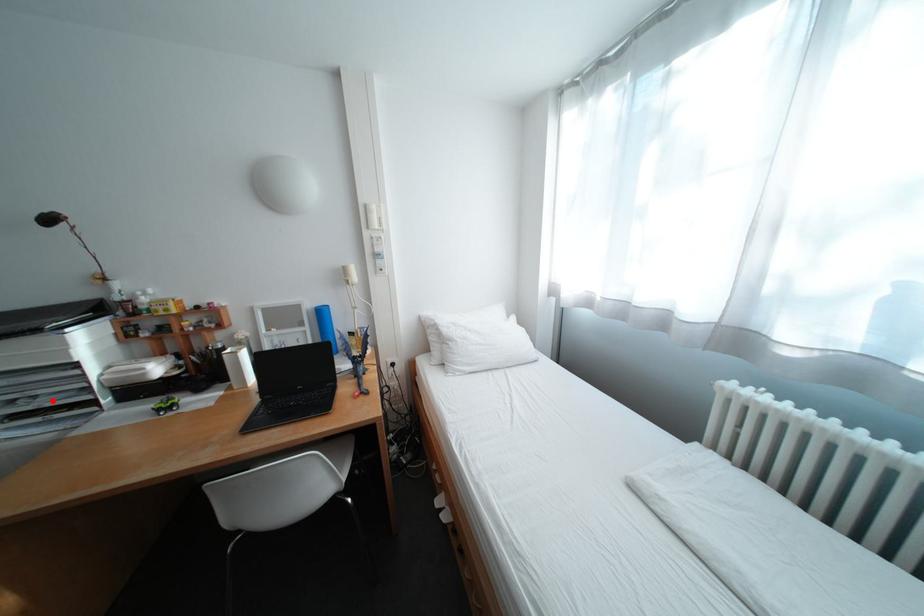
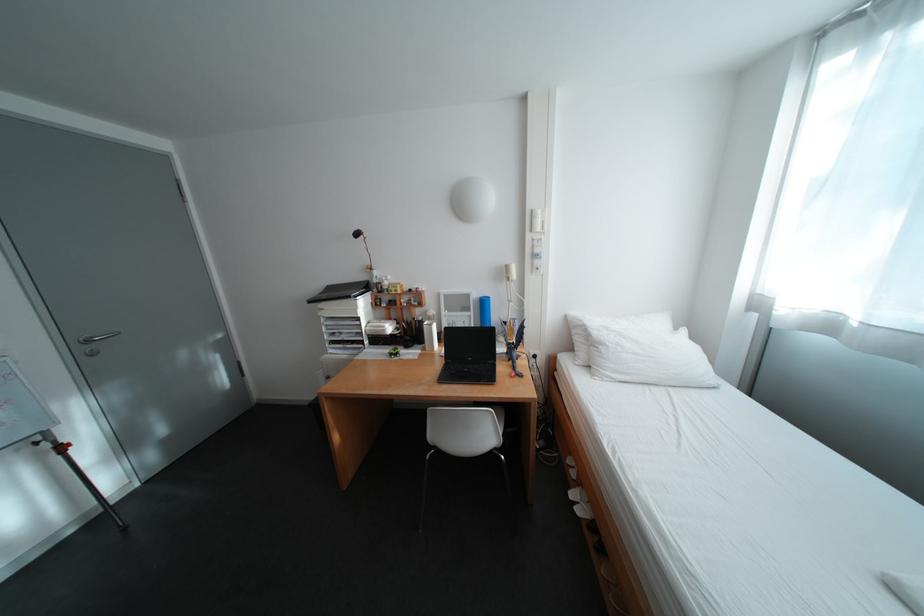
Locate, in the second image, the point that corresponds to the highlighted location in the first image.

(355, 336)